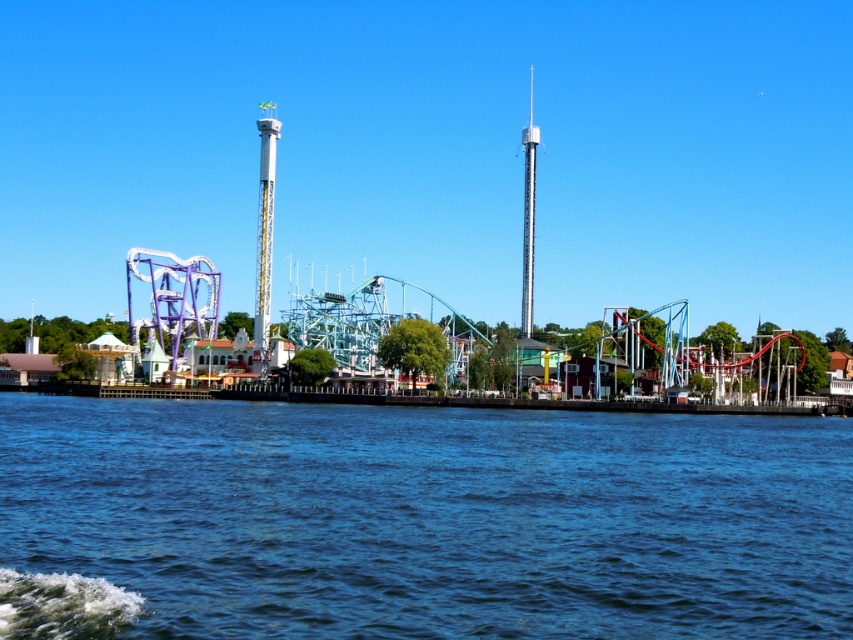
Does blue water at lower left have a larger size compared to yellow metallic tower at center?

No, blue water at lower left is not bigger than yellow metallic tower at center.

Can you confirm if blue water at lower left is positioned to the right of yellow metallic tower at center?

Indeed, blue water at lower left is positioned on the right side of yellow metallic tower at center.

Where is `blue water at lower left`? blue water at lower left is located at coordinates (416, 522).

Can you confirm if metallic roller coaster at center is thinner than metallic silver tower at center?

Incorrect, metallic roller coaster at center's width is not less than metallic silver tower at center's.

Does metallic roller coaster at center appear over metallic silver tower at center?

Actually, metallic roller coaster at center is below metallic silver tower at center.

Is point (344, 390) positioned after point (529, 129)?

No, (344, 390) is in front of (529, 129).

Where is `metallic roller coaster at center`? The width and height of the screenshot is (853, 640). metallic roller coaster at center is located at coordinates (160, 301).

Can you confirm if yellow metallic tower at center is thinner than metallic silver tower at center?

No.

Based on the photo, between yellow metallic tower at center and metallic silver tower at center, which one appears on the right side from the viewer's perspective?

From the viewer's perspective, metallic silver tower at center appears more on the right side.

Which is behind, point (268, 172) or point (529, 112)?

The point (529, 112) is behind.

Locate an element on the screen. Image resolution: width=853 pixels, height=640 pixels. yellow metallic tower at center is located at coordinates (264, 236).